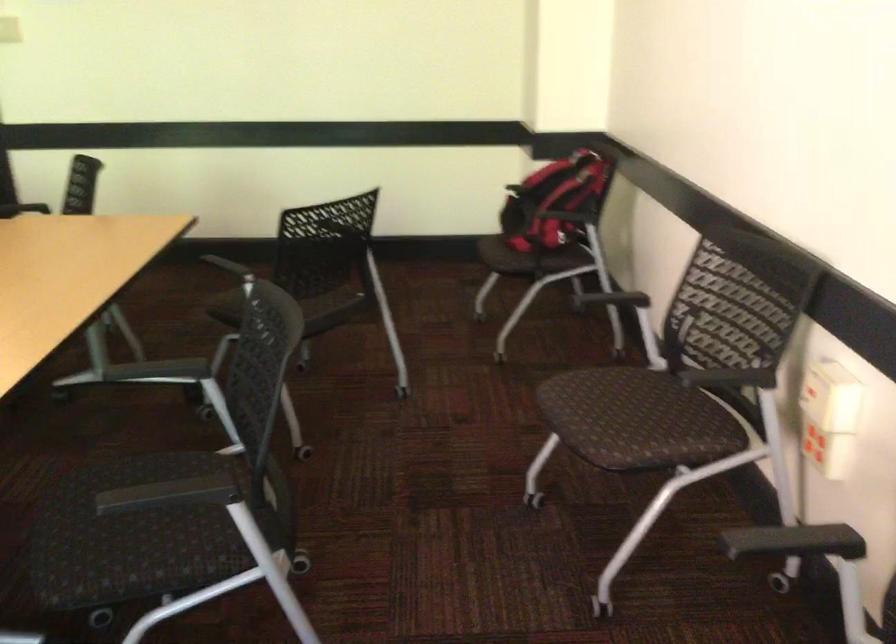
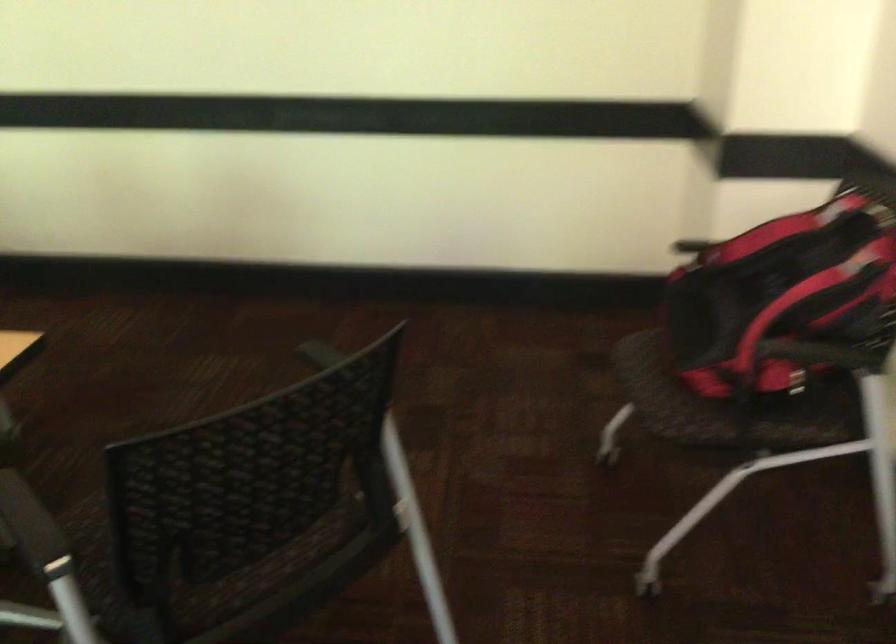
The point at (552,190) is marked in the first image. Where is the corresponding point in the second image?

(785, 283)